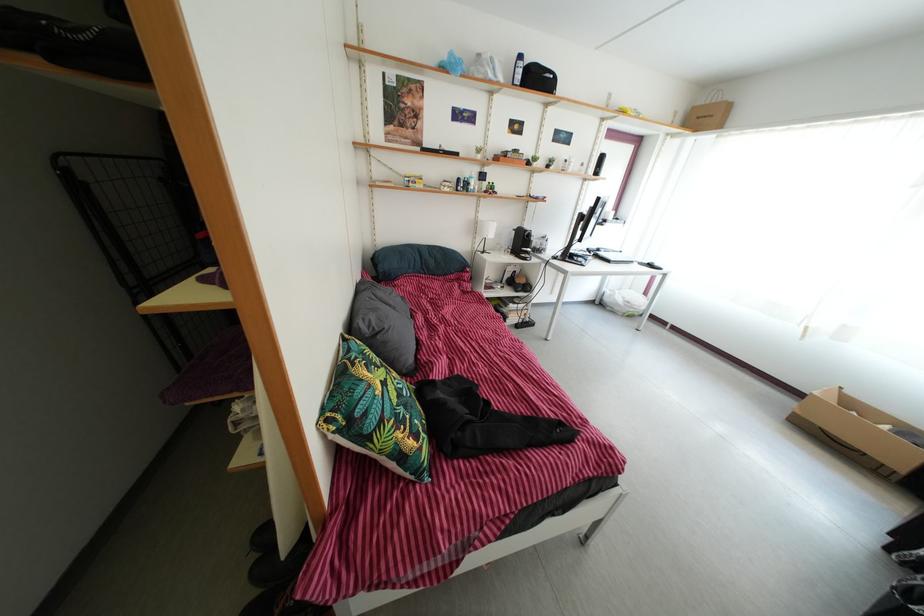
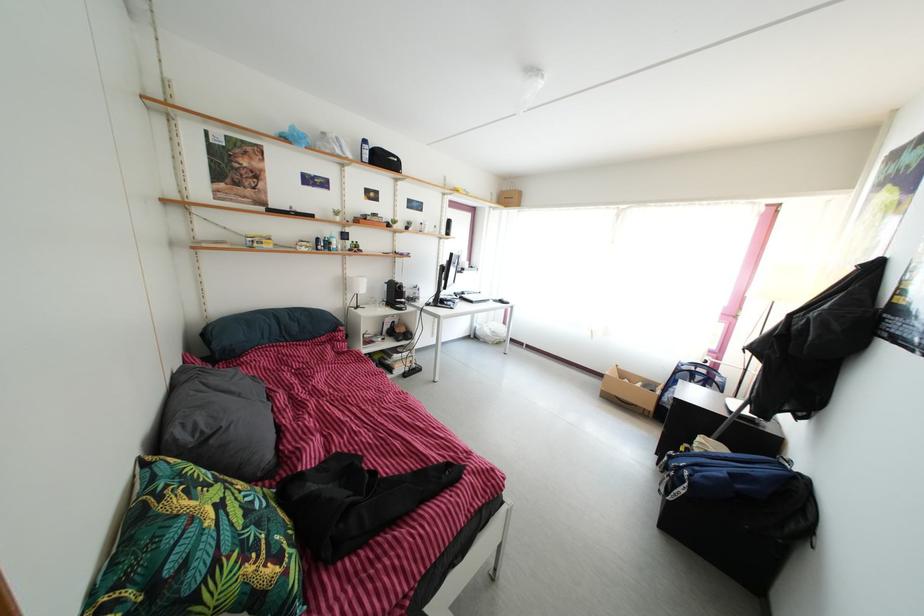
What movement of the cameraman would produce the second image?

The cameraman walked toward right, backward.